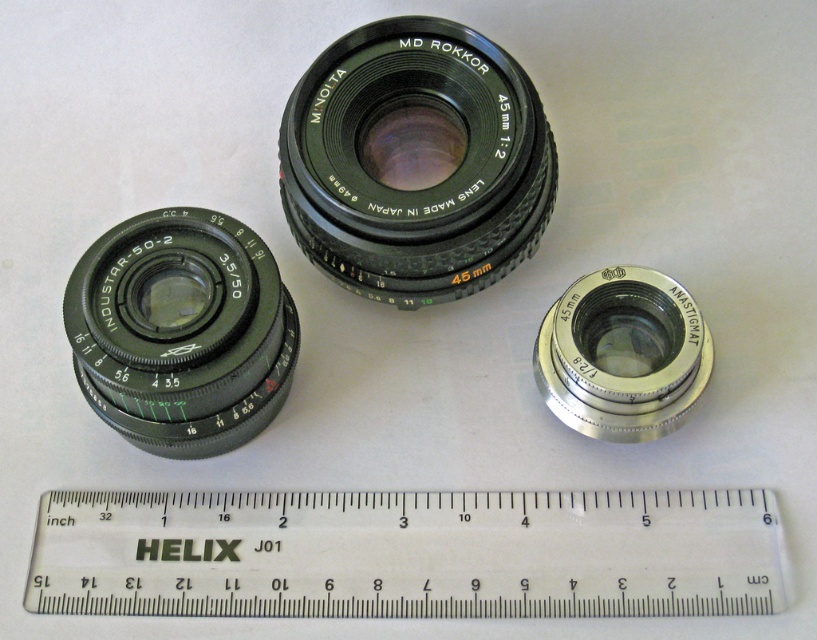
You are a photographer trying to organize your equipment. You have a white plastic ruler at bottom and a silver metallic anastigmat at center on your worktable. Which object is positioned lower on the table?

The white plastic ruler at bottom is located below the silver metallic anastigmat at center, so it is positioned lower on the table.

You are a photographer setting up a display for a photography exhibition. You have two lenses, the matte black lens at lower left and the silver metallic anastigmat at center. The exhibition requires that the distance between these two lenses must be exactly 50 centimeters. Can you adjust their positions to meet this requirement?

The current distance between the matte black lens at lower left and the silver metallic anastigmat at center is 48.16 centimeters. To meet the 50 centimeter requirement, you need to increase the distance between them by approximately 1.84 centimeters.